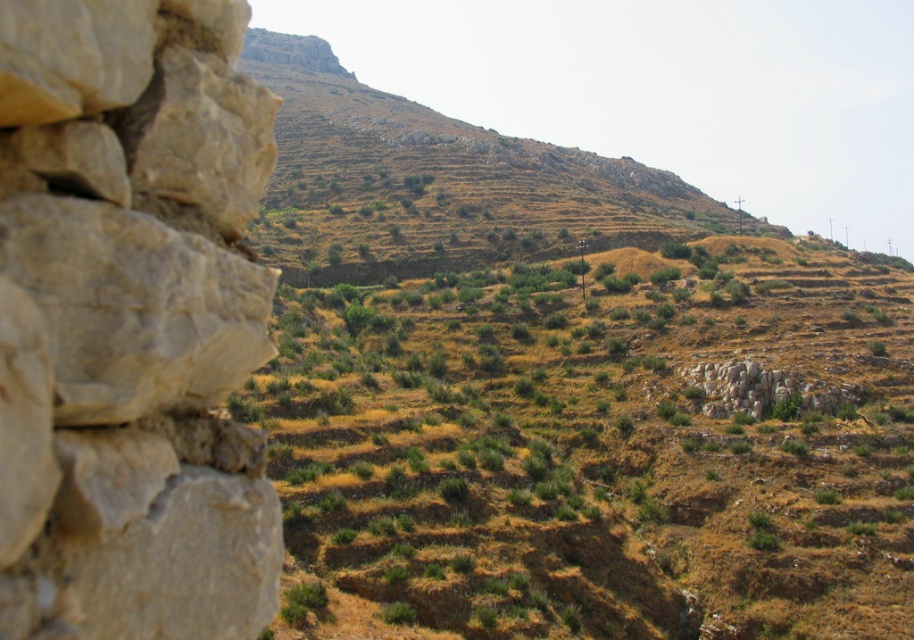
You are a hiker who wants to cross from the natural beige stone at left to the green grassy field at center. Is the path between them wide enough for you to walk through?

The green grassy field at center is much taller than the natural beige stone at left, so the path between them may be narrow. However, since the question is about width, not height, the description does not provide information about the width of the path. Therefore, it is unclear if the path is wide enough for you to walk through based on the given information.

You are standing at the base of the rocky hillside and want to reach the terraced fields in the middle ground. There are two points marked on your map as point A at coordinates point A is point (681, 362) and point B at coordinates point B is point (618, 220). Which point should you head towards to get closer to the terraced fields?

Point A at coordinates point A is point (681, 362) is closer to the viewer than point B at coordinates point B is point (618, 220). Therefore, you should head towards point A to get closer to the terraced fields since it is nearer to your current position at the base of the hillside.